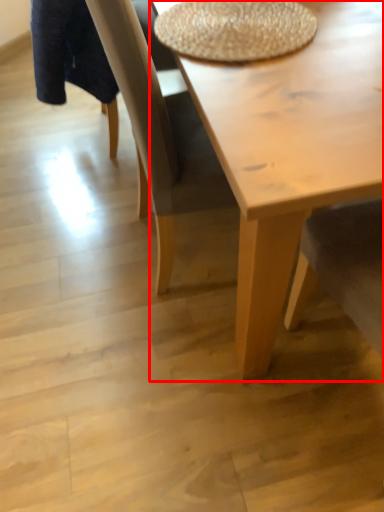
Question: From the image's perspective, where is coffee table (annotated by the red box) located relative to round table?

Choices:
 (A) below
 (B) above

Answer: (A)